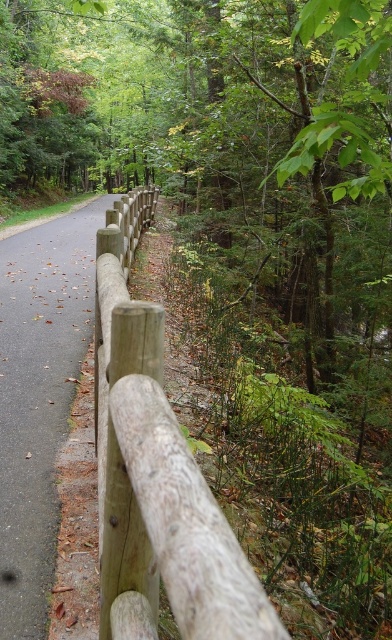
You are standing on the forest path and see two points marked on the ground. The first point is at coordinate point (112, 488) and the second is at point (99, 209). If you are facing the direction of the path, which point is closer to you?

Point (112, 488) is in front of point (99, 209), so if you are facing the direction of the path, the point closer to you would be point (112, 488).

You are standing at the starting point of the forest path. You want to reach the wooden fence at center as quickly as possible. Which direction should you walk towards?

You should walk towards the center of the forest path to reach the wooden fence at center quickly since it is located at point [157,488].